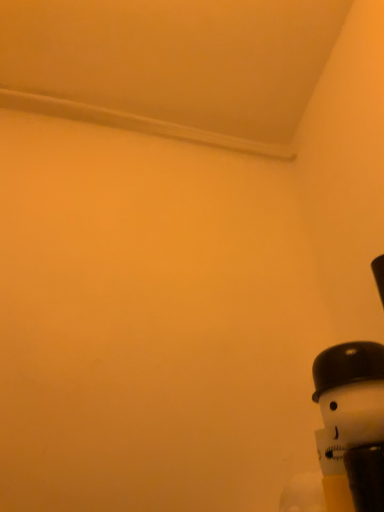
Identify the location of white matte snowman at lower right. (347, 413).

Describe the element at coordinates (347, 413) in the screenshot. I see `white matte snowman at lower right` at that location.

What are the coordinates of `white matte snowman at lower right` in the screenshot? It's located at (347, 413).